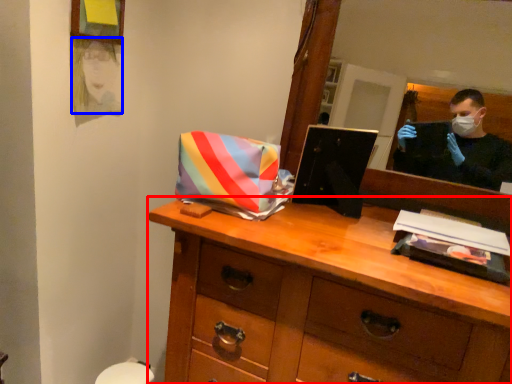
Question: Which object is closer to the camera taking this photo, chest of drawers (highlighted by a red box) or person (highlighted by a blue box)?

Choices:
 (A) chest of drawers
 (B) person

Answer: (A)